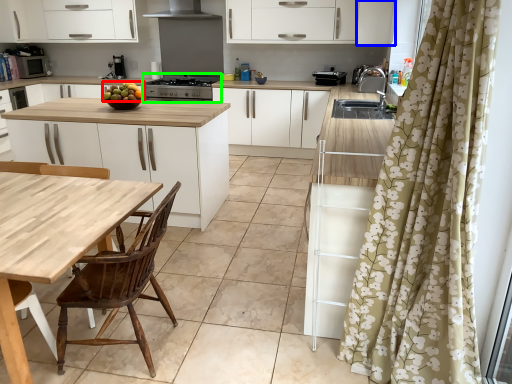
Question: Based on their relative distances, which object is nearer to fruit (highlighted by a red box)? Choose from cabinetry (highlighted by a blue box) and kitchen appliance (highlighted by a green box).

Choices:
 (A) cabinetry
 (B) kitchen appliance

Answer: (B)